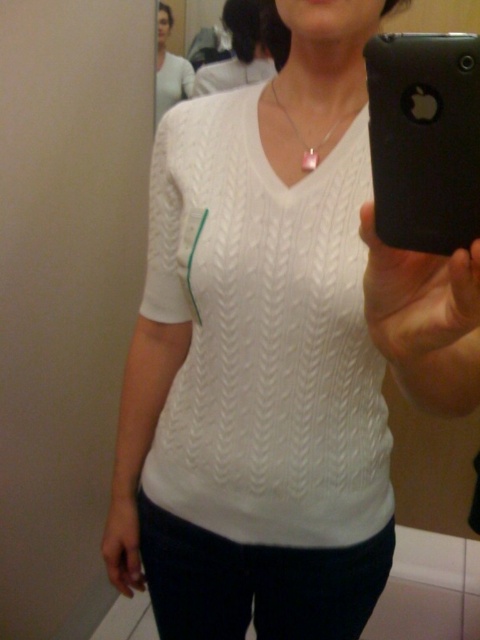
Does point (467, 45) lie in front of point (159, 54)?

Yes, point (467, 45) is in front of point (159, 54).

Does black plastic phone at upper right come behind white knitted sweater at upper center?

No, it is in front of white knitted sweater at upper center.

What do you see at coordinates (424, 140) in the screenshot? I see `black plastic phone at upper right` at bounding box center [424, 140].

You are a GUI agent. You are given a task and a screenshot of the screen. Output one action in this format:
    pyautogui.click(x=<x>, y=<y>)
    Task: Click on the black plastic phone at upper right
    The image size is (480, 640).
    Given the screenshot: What is the action you would take?
    click(424, 140)

Does white knitted shirt at center appear over black plastic phone at upper right?

No.

Find the location of a particular element. This screenshot has width=480, height=640. white knitted shirt at center is located at coordinates (264, 336).

Who is higher up, black plastic phone at upper right or pink glass pendant at center?

pink glass pendant at center

Can you confirm if black plastic phone at upper right is thinner than pink glass pendant at center?

Correct, black plastic phone at upper right's width is less than pink glass pendant at center's.

Between point (372, 96) and point (311, 147), which one is positioned behind?

The point (311, 147) is behind.

Locate an element on the screen. black plastic phone at upper right is located at coordinates (424, 140).